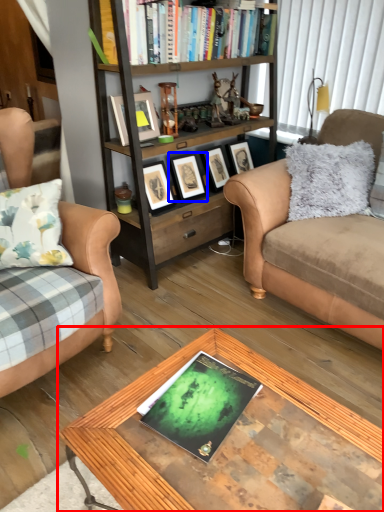
Question: Among these objects, which one is nearest to the camera, coffee table (highlighted by a red box) or picture frame (highlighted by a blue box)?

Choices:
 (A) coffee table
 (B) picture frame

Answer: (A)